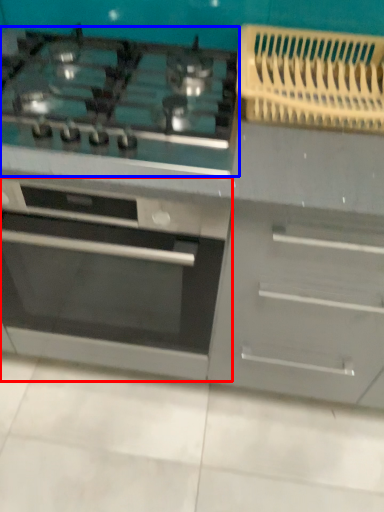
Question: Which object is closer to the camera taking this photo, oven (highlighted by a red box) or gas stove (highlighted by a blue box)?

Choices:
 (A) oven
 (B) gas stove

Answer: (B)